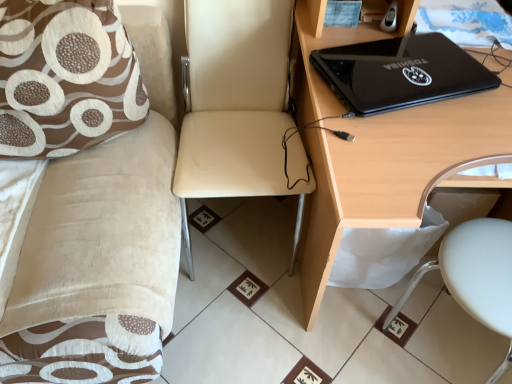
Question: Does brown fabric pillow at left have a greater width compared to beige leather chair at center?

Choices:
 (A) yes
 (B) no

Answer: (B)

Question: Can you confirm if brown fabric pillow at left is bigger than beige leather chair at center?

Choices:
 (A) yes
 (B) no

Answer: (B)

Question: From the image's perspective, would you say brown fabric pillow at left is positioned over beige leather chair at center?

Choices:
 (A) no
 (B) yes

Answer: (B)

Question: Is brown fabric pillow at left positioned before beige leather chair at center?

Choices:
 (A) no
 (B) yes

Answer: (A)

Question: Considering the relative positions of brown fabric pillow at left and beige leather chair at center in the image provided, is brown fabric pillow at left to the left of beige leather chair at center from the viewer's perspective?

Choices:
 (A) yes
 (B) no

Answer: (A)

Question: Is point (34, 208) positioned closer to the camera than point (418, 120)?

Choices:
 (A) farther
 (B) closer

Answer: (A)

Question: From their relative heights in the image, would you say beige fabric couch at upper left is taller or shorter than black glossy laptop at upper right?

Choices:
 (A) short
 (B) tall

Answer: (A)

Question: In terms of size, does beige fabric couch at upper left appear bigger or smaller than black glossy laptop at upper right?

Choices:
 (A) big
 (B) small

Answer: (B)

Question: Visually, is beige fabric couch at upper left positioned to the left or to the right of black glossy laptop at upper right?

Choices:
 (A) left
 (B) right

Answer: (A)

Question: In terms of width, does beige fabric couch at upper left look wider or thinner when compared to beige leather chair at center?

Choices:
 (A) thin
 (B) wide

Answer: (B)

Question: From a real-world perspective, is beige fabric couch at upper left positioned above or below beige leather chair at center?

Choices:
 (A) above
 (B) below

Answer: (B)

Question: Looking at the image, does beige fabric couch at upper left seem bigger or smaller compared to beige leather chair at center?

Choices:
 (A) big
 (B) small

Answer: (A)

Question: Considering the positions of beige fabric couch at upper left and beige leather chair at center in the image, is beige fabric couch at upper left taller or shorter than beige leather chair at center?

Choices:
 (A) short
 (B) tall

Answer: (A)

Question: From the image's perspective, is beige fabric couch at upper left above or below black glossy laptop at upper right?

Choices:
 (A) above
 (B) below

Answer: (B)

Question: Choose the correct answer: Is beige fabric couch at upper left inside black glossy laptop at upper right or outside it?

Choices:
 (A) inside
 (B) outside

Answer: (B)